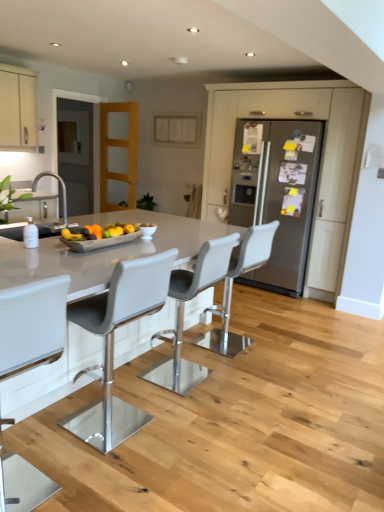
Question: Considering the relative sizes of white leather bar stool at center, acting as the 3th chair starting from the front, and transparent glass door at left in the image provided, is white leather bar stool at center, acting as the 3th chair starting from the front, thinner than transparent glass door at left?

Choices:
 (A) yes
 (B) no

Answer: (B)

Question: Is white leather bar stool at center, acting as the 3th chair starting from the front, to the right of transparent glass door at left from the viewer's perspective?

Choices:
 (A) no
 (B) yes

Answer: (B)

Question: Considering the relative sizes of white leather bar stool at center, the second chair in the back-to-front sequence, and transparent glass door at left in the image provided, is white leather bar stool at center, the second chair in the back-to-front sequence, wider than transparent glass door at left?

Choices:
 (A) no
 (B) yes

Answer: (B)

Question: Is white leather bar stool at center, the second chair in the back-to-front sequence, placed right next to transparent glass door at left?

Choices:
 (A) yes
 (B) no

Answer: (B)

Question: Can you confirm if white leather bar stool at center, the second chair in the back-to-front sequence, is bigger than transparent glass door at left?

Choices:
 (A) yes
 (B) no

Answer: (B)

Question: Would you say white leather bar stool at center, positioned as the fourth chair in back-to-front order, is inside or outside matte white cabinet at upper center, which is counted as the second cabinetry, starting from the right?

Choices:
 (A) inside
 (B) outside

Answer: (B)

Question: Is white leather bar stool at center, acting as the 1th chair starting from the front, taller or shorter than matte white cabinet at upper center, the second cabinetry positioned from the left?

Choices:
 (A) short
 (B) tall

Answer: (B)

Question: From the image's perspective, is white leather bar stool at center, positioned as the fourth chair in back-to-front order, above or below matte white cabinet at upper center, the second cabinetry positioned from the left?

Choices:
 (A) below
 (B) above

Answer: (A)

Question: From a real-world perspective, is white leather bar stool at center, acting as the 1th chair starting from the front, physically located above or below matte white cabinet at upper center, the second cabinetry positioned from the left?

Choices:
 (A) below
 (B) above

Answer: (A)

Question: Is transparent glass door at left to the left or to the right of matte gray refrigerator at center, the first cabinetry in the right-to-left sequence, in the image?

Choices:
 (A) left
 (B) right

Answer: (A)

Question: Considering the positions of transparent glass door at left and matte gray refrigerator at center, placed as the third cabinetry when sorted from left to right, in the image, is transparent glass door at left bigger or smaller than matte gray refrigerator at center, placed as the third cabinetry when sorted from left to right,?

Choices:
 (A) big
 (B) small

Answer: (B)

Question: Would you say transparent glass door at left is inside or outside matte gray refrigerator at center, the first cabinetry in the right-to-left sequence?

Choices:
 (A) outside
 (B) inside

Answer: (A)

Question: From the image's perspective, is transparent glass door at left above or below matte gray refrigerator at center, placed as the third cabinetry when sorted from left to right?

Choices:
 (A) below
 (B) above

Answer: (B)

Question: Do you think white leather bar stool at center, positioned as the fourth chair in back-to-front order, is within transparent glass door at left, or outside of it?

Choices:
 (A) outside
 (B) inside

Answer: (A)

Question: In terms of height, does white leather bar stool at center, acting as the 1th chair starting from the front, look taller or shorter compared to transparent glass door at left?

Choices:
 (A) tall
 (B) short

Answer: (B)